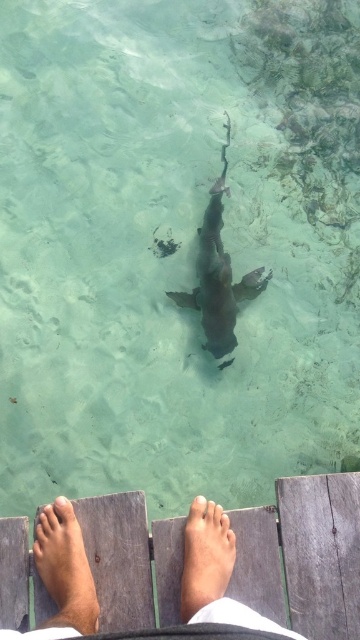
Can you confirm if smooth gray shark at center is positioned to the right of pink flesh at center?

Indeed, smooth gray shark at center is positioned on the right side of pink flesh at center.

Does smooth gray shark at center have a larger size compared to pink flesh at center?

Yes, smooth gray shark at center is bigger than pink flesh at center.

Describe the element at coordinates (218, 273) in the screenshot. I see `smooth gray shark at center` at that location.

Find the location of a particular element. The width and height of the screenshot is (360, 640). smooth gray shark at center is located at coordinates (218, 273).

What do you see at coordinates (65, 570) in the screenshot? Image resolution: width=360 pixels, height=640 pixels. I see `brown wood foot at lower left` at bounding box center [65, 570].

Is point (57, 513) closer to camera compared to point (56, 502)?

Yes, it is.

Is point (65, 556) positioned behind point (64, 497)?

No, (65, 556) is closer to viewer.

Identify the location of brown wood foot at lower left. (65, 570).

Who is higher up, pink flesh at center or pale skin toe at lower center?

pale skin toe at lower center is above.

Which is more to the left, pink flesh at center or pale skin toe at lower center?

Positioned to the left is pale skin toe at lower center.

Is point (223, 518) closer to camera compared to point (196, 497)?

Yes.

Locate an element on the screen. The image size is (360, 640). pink flesh at center is located at coordinates (223, 520).